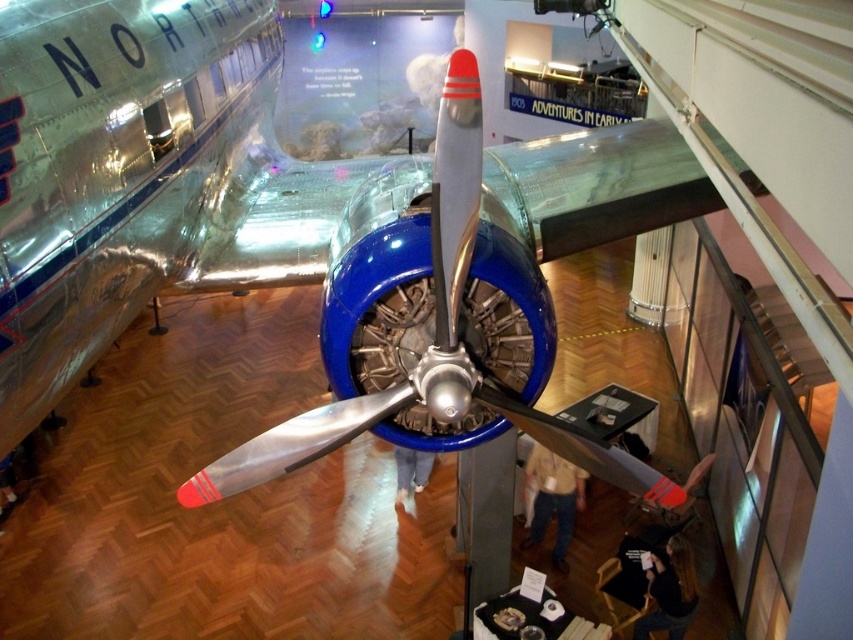
Which is in front, point (561, 467) or point (396, 445)?

Point (561, 467)

Who is positioned more to the right, light brown leather jacket at center or denim pants at center?

light brown leather jacket at center is more to the right.

Between point (556, 522) and point (422, 490), which one is positioned in front?

Point (556, 522) is in front.

Locate an element on the screen. light brown leather jacket at center is located at coordinates (553, 499).

Measure the distance between polished aluminum airplane at center and camera.

The distance of polished aluminum airplane at center from camera is 1.42 meters.

Measure the distance from polished aluminum airplane at center to dark brown leather jacket at lower right.

3.25 meters

At what (x,y) coordinates should I click in order to perform the action: click on polished aluminum airplane at center. Please return your answer as a coordinate pair (x, y). The image size is (853, 640). Looking at the image, I should click on (312, 237).

Who is taller, light brown leather jacket at center or dark brown leather jacket at lower right?

With more height is light brown leather jacket at center.

Who is more forward, (585, 477) or (648, 625)?

Point (648, 625)

Is point (553, 512) positioned before point (648, 557)?

No, (553, 512) is behind (648, 557).

Identify the location of light brown leather jacket at center. The width and height of the screenshot is (853, 640). (553, 499).